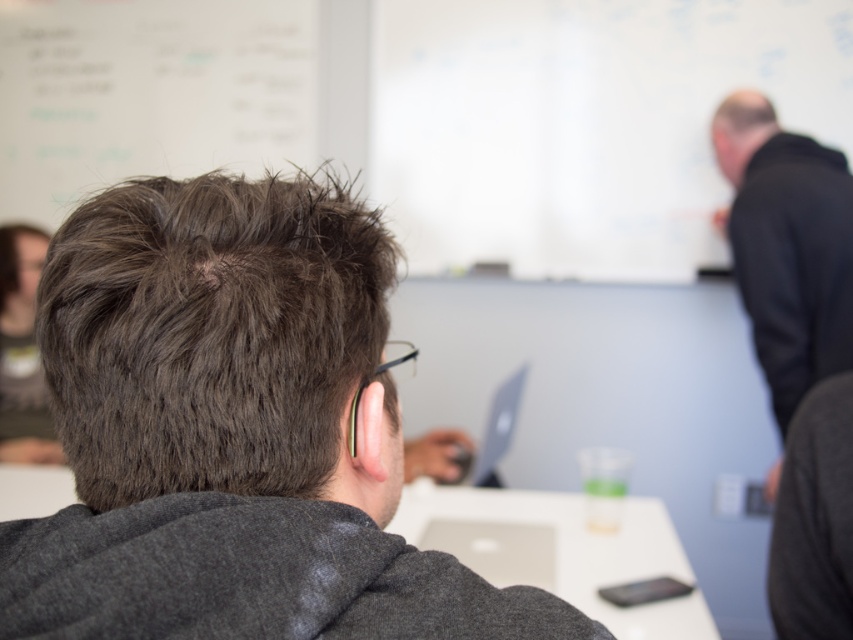
You are organizing a classroom layout and need to place a rack that is 1.2 meters wide between the dark gray hoodie at center and the black matte jacket at upper right. Can the rack fit between them based on their widths?

The dark gray hoodie at center is wider than the black matte jacket at upper right, so the 1.2 meter rack may not fit between them if the total width of both objects exceeds the rack width. However, the exact distance between them isn

From the picture: You are standing in the classroom and want to hand a document to the person wearing the black matte jacket at upper right. If you are 1.7 meters tall, can you reach them without moving closer?

The distance between you and the black matte jacket at upper right is 2.06 meters. Since you are 1.7 meters tall, you cannot reach them as the distance is greater than your height.

You are standing in the classroom and see two points on the whiteboard. The first point is at coordinates point (548, 620) and the second point is at point (703, 600). Which point is closer to you?

Point (548, 620) is closer to the viewer than point (703, 600).